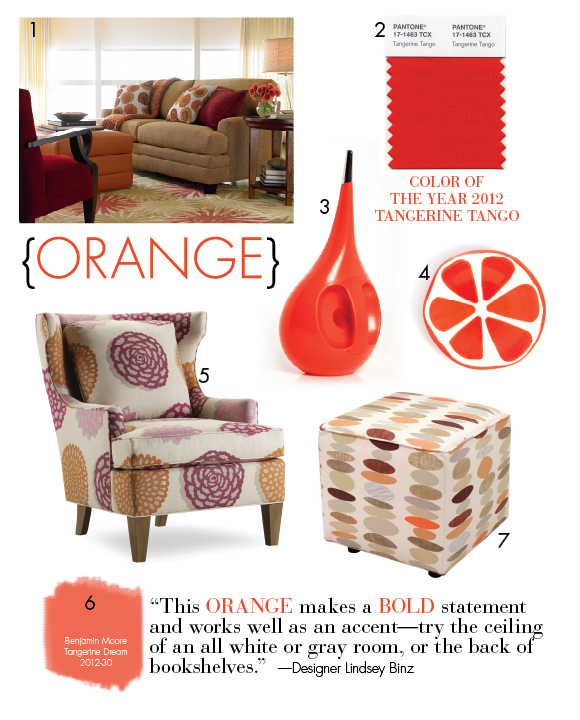
Where is `arm chair`? The width and height of the screenshot is (580, 720). arm chair is located at coordinates (141, 390), (66, 174).